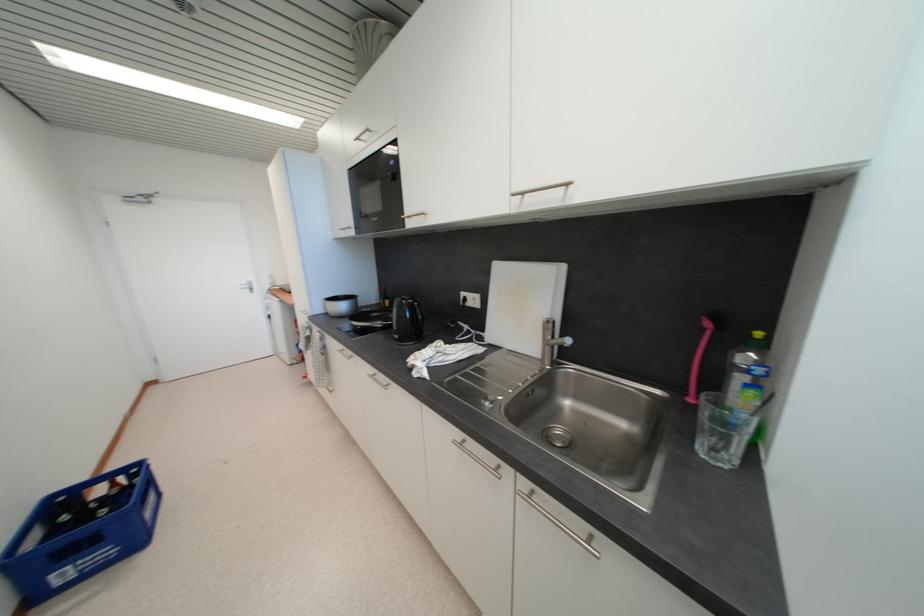
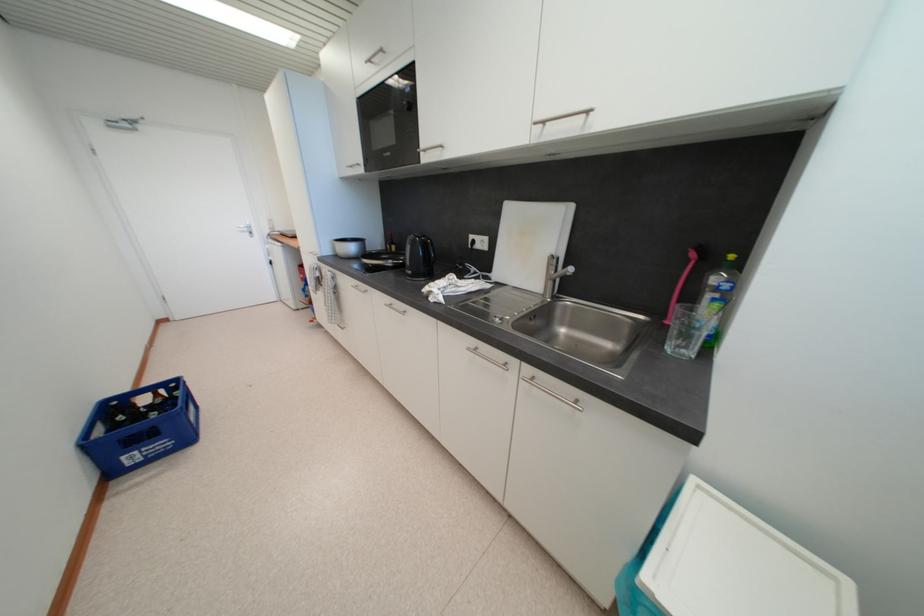
Locate, in the second image, the point that corresponds to point 363,140 in the first image.

(375, 63)